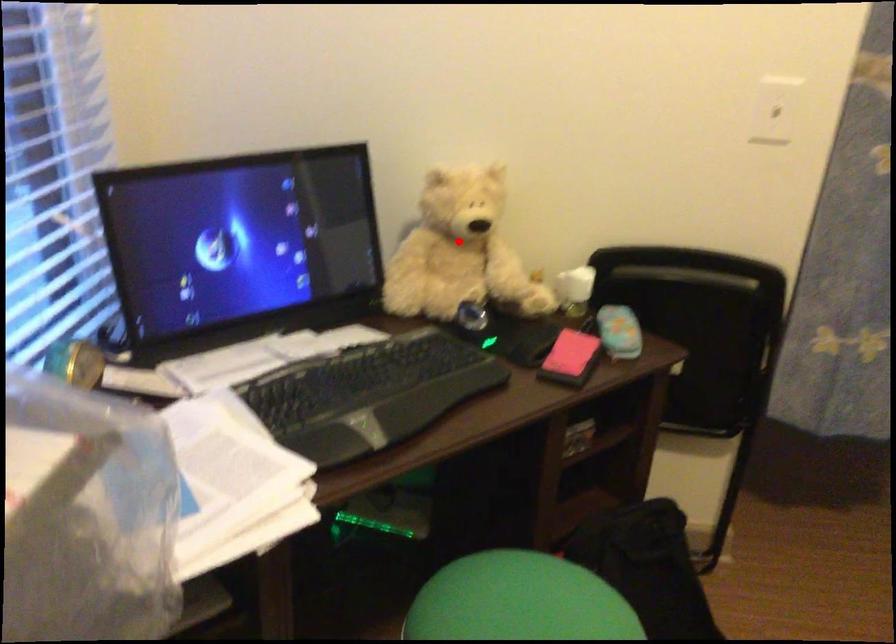
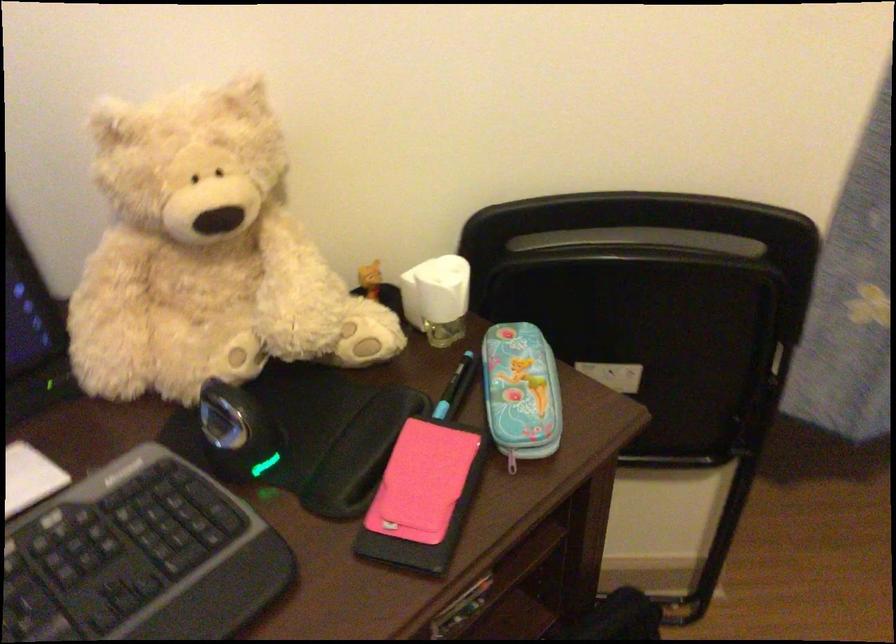
Where in the second image is the point corresponding to the highlighted location from the first image?

(205, 254)